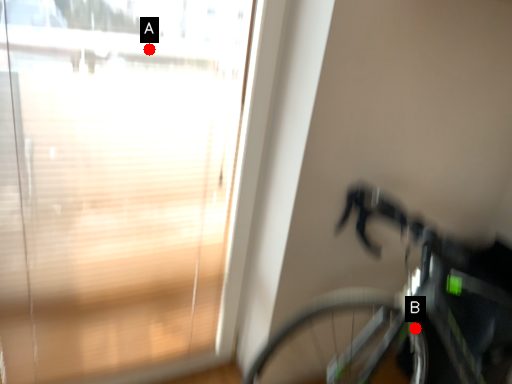
Question: Two points are circled on the image, labeled by A and B beside each circle. Which of the following is the farthest from the observer?

Choices:
 (A) A is further
 (B) B is further

Answer: (B)